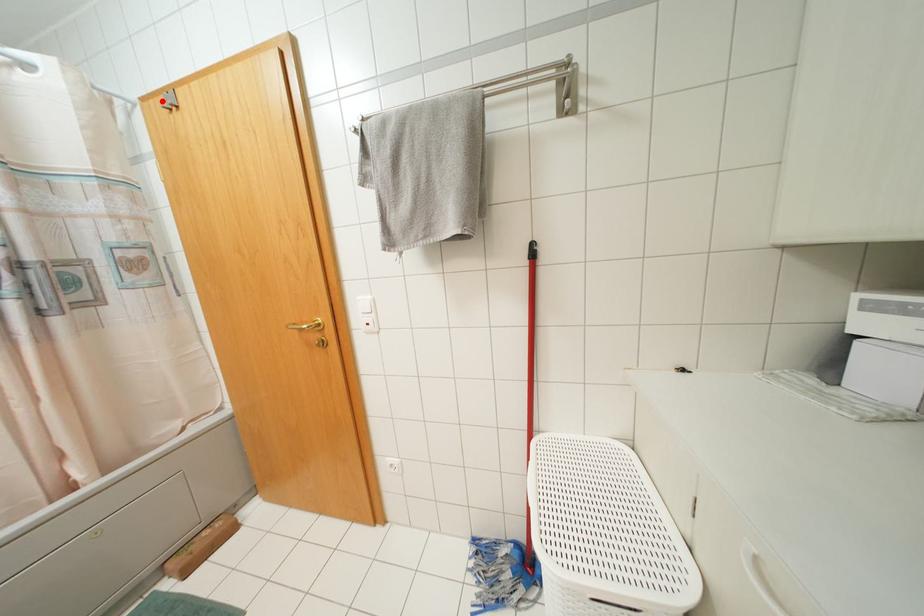
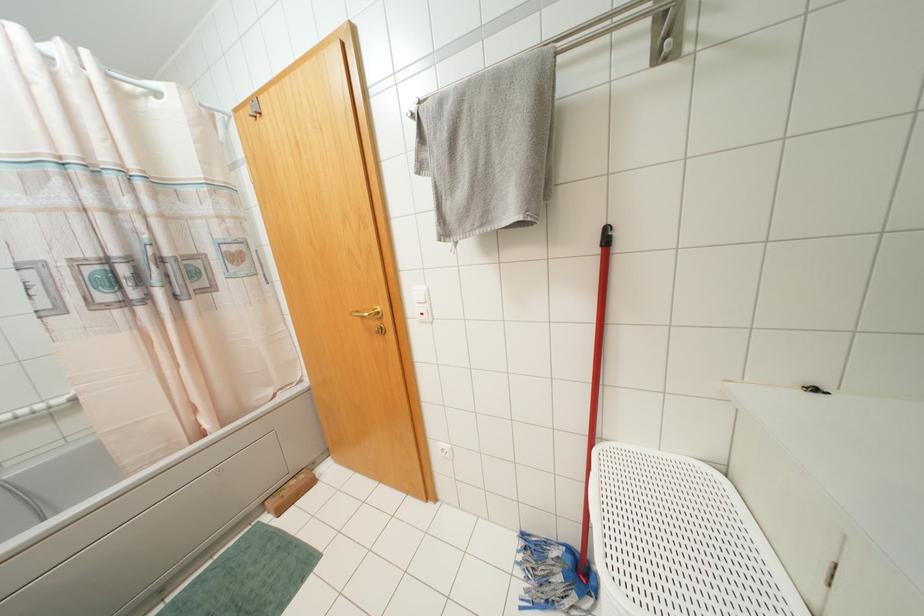
Find the pixel in the second image that matches the highlighted location in the first image.

(249, 110)